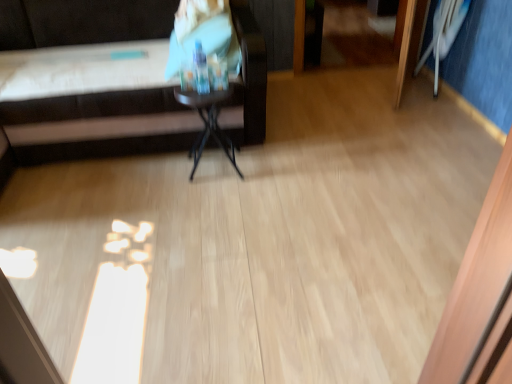
Question: Is brown leather couch at upper left at the left side of matte plastic bottle at upper center?

Choices:
 (A) no
 (B) yes

Answer: (B)

Question: Considering the relative positions of brown leather couch at upper left and matte plastic bottle at upper center in the image provided, is brown leather couch at upper left to the right of matte plastic bottle at upper center from the viewer's perspective?

Choices:
 (A) no
 (B) yes

Answer: (A)

Question: Considering the relative sizes of brown leather couch at upper left and matte plastic bottle at upper center in the image provided, is brown leather couch at upper left shorter than matte plastic bottle at upper center?

Choices:
 (A) yes
 (B) no

Answer: (B)

Question: Does brown leather couch at upper left have a larger size compared to matte plastic bottle at upper center?

Choices:
 (A) yes
 (B) no

Answer: (A)

Question: Is brown leather couch at upper left directly adjacent to matte plastic bottle at upper center?

Choices:
 (A) no
 (B) yes

Answer: (A)

Question: Visually, is black glossy side table at center positioned to the left or to the right of white plastic swivel chair at upper right?

Choices:
 (A) left
 (B) right

Answer: (A)

Question: Is black glossy side table at center situated inside white plastic swivel chair at upper right or outside?

Choices:
 (A) inside
 (B) outside

Answer: (B)

Question: In terms of size, does black glossy side table at center appear bigger or smaller than white plastic swivel chair at upper right?

Choices:
 (A) small
 (B) big

Answer: (A)

Question: In terms of width, does black glossy side table at center look wider or thinner when compared to white plastic swivel chair at upper right?

Choices:
 (A) thin
 (B) wide

Answer: (B)

Question: Is matte plastic bottle at upper center spatially inside black glossy side table at center, or outside of it?

Choices:
 (A) outside
 (B) inside

Answer: (A)

Question: Is point (230, 23) positioned closer to the camera than point (207, 109)?

Choices:
 (A) closer
 (B) farther

Answer: (B)

Question: In the image, is matte plastic bottle at upper center on the left side or the right side of black glossy side table at center?

Choices:
 (A) left
 (B) right

Answer: (A)

Question: Considering their positions, is matte plastic bottle at upper center located in front of or behind black glossy side table at center?

Choices:
 (A) front
 (B) behind

Answer: (B)

Question: From the image's perspective, is white plastic swivel chair at upper right above or below matte plastic bottle at upper center?

Choices:
 (A) below
 (B) above

Answer: (B)

Question: Is point (451, 3) closer or farther from the camera than point (209, 44)?

Choices:
 (A) closer
 (B) farther

Answer: (B)